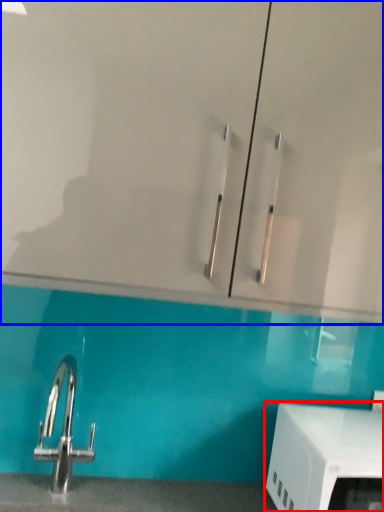
Question: Which point is further to the camera, appliance (highlighted by a red box) or glass door (highlighted by a blue box)?

Choices:
 (A) appliance
 (B) glass door

Answer: (A)